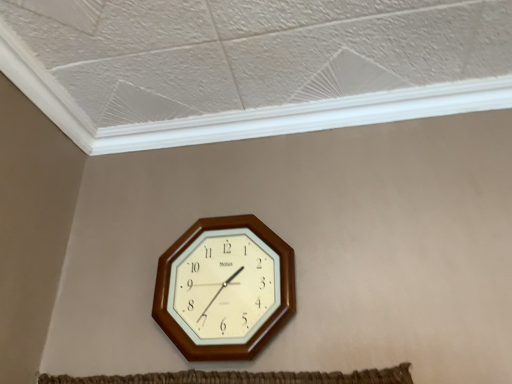
Question: Does white plastic trim at upper center lie behind wooden wall clock at center?

Choices:
 (A) no
 (B) yes

Answer: (B)

Question: From the image's perspective, would you say white plastic trim at upper center is positioned over wooden wall clock at center?

Choices:
 (A) yes
 (B) no

Answer: (A)

Question: Is white plastic trim at upper center located outside wooden wall clock at center?

Choices:
 (A) yes
 (B) no

Answer: (A)

Question: Does white plastic trim at upper center have a lesser width compared to wooden wall clock at center?

Choices:
 (A) no
 (B) yes

Answer: (A)

Question: Considering the relative sizes of white plastic trim at upper center and wooden wall clock at center in the image provided, is white plastic trim at upper center shorter than wooden wall clock at center?

Choices:
 (A) no
 (B) yes

Answer: (B)

Question: Can you confirm if white plastic trim at upper center is bigger than wooden wall clock at center?

Choices:
 (A) no
 (B) yes

Answer: (A)

Question: From the image's perspective, is wooden wall clock at center located beneath white plastic trim at upper center?

Choices:
 (A) no
 (B) yes

Answer: (B)

Question: Is wooden wall clock at center taller than white plastic trim at upper center?

Choices:
 (A) yes
 (B) no

Answer: (A)

Question: From a real-world perspective, is wooden wall clock at center beneath white plastic trim at upper center?

Choices:
 (A) no
 (B) yes

Answer: (B)

Question: Is wooden wall clock at center smaller than white plastic trim at upper center?

Choices:
 (A) yes
 (B) no

Answer: (B)

Question: From the image's perspective, is wooden wall clock at center over white plastic trim at upper center?

Choices:
 (A) no
 (B) yes

Answer: (A)

Question: Are wooden wall clock at center and white plastic trim at upper center far apart?

Choices:
 (A) no
 (B) yes

Answer: (A)

Question: From a real-world perspective, is wooden wall clock at center positioned above or below white plastic trim at upper center?

Choices:
 (A) below
 (B) above

Answer: (A)